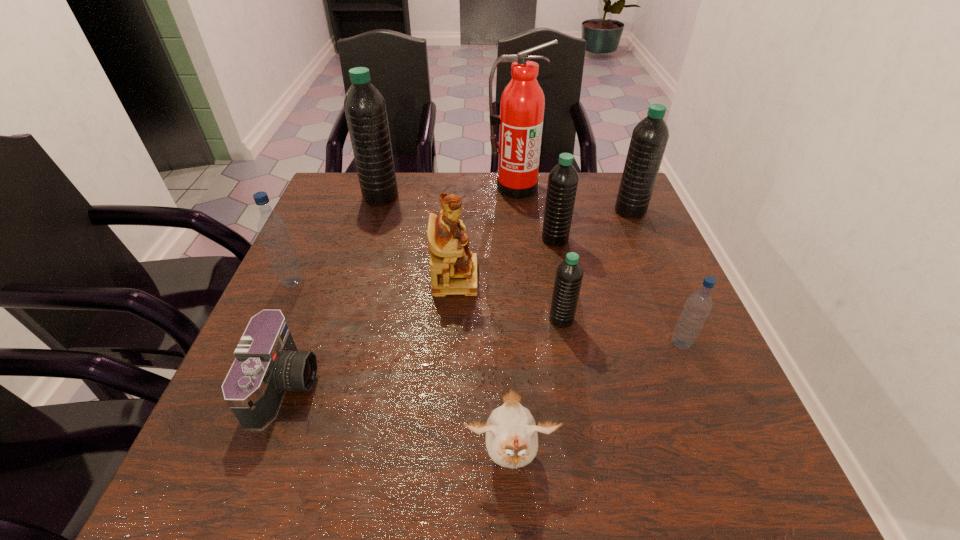
This screenshot has height=540, width=960. I want to click on object located at the far left corner, so click(365, 108).

Where is `object located at the far right corner`? The width and height of the screenshot is (960, 540). object located at the far right corner is located at coordinates (649, 139).

Identify the location of free region at the far edge of the desktop. (419, 213).

I want to click on vacant area at the near edge, so click(541, 478).

The image size is (960, 540). What are the coordinates of `free space at the left edge of the desktop` in the screenshot? It's located at (335, 290).

Identify the location of vacant space at the right edge. The height and width of the screenshot is (540, 960). (712, 403).

Find the location of a particular element. The image size is (960, 540). vacant area at the far left corner is located at coordinates (343, 181).

I want to click on free space at the far right corner of the desktop, so click(605, 215).

Locate an element on the screen. free area in between the fourth farthest object and the leftmost water bottle is located at coordinates (424, 261).

Find the location of a particular element. unoccupied area between the second shortest object and the fourth farthest object is located at coordinates (533, 348).